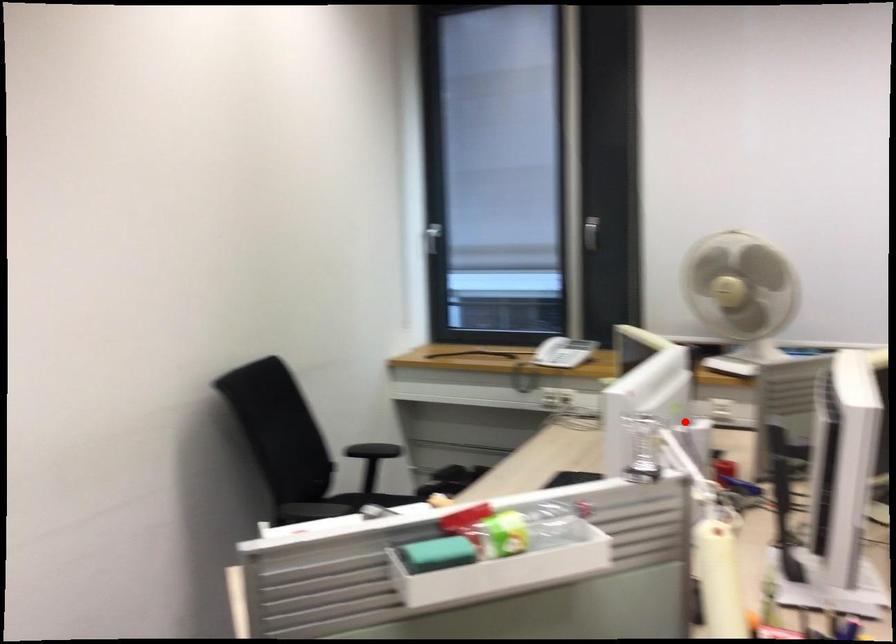
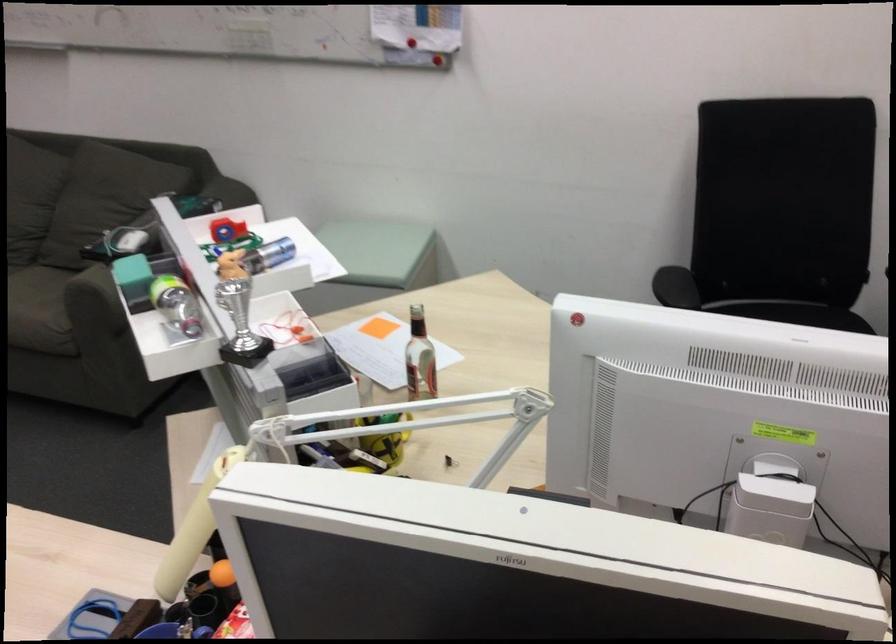
Question: I am providing you with two images of the same scene from different viewpoints. Image1 has a red point marked. In image2, the corresponding 3D location appears at what relative position? Reply with the corresponding letter.

Choices:
 (A) Closer
 (B) Farther

Answer: (A)